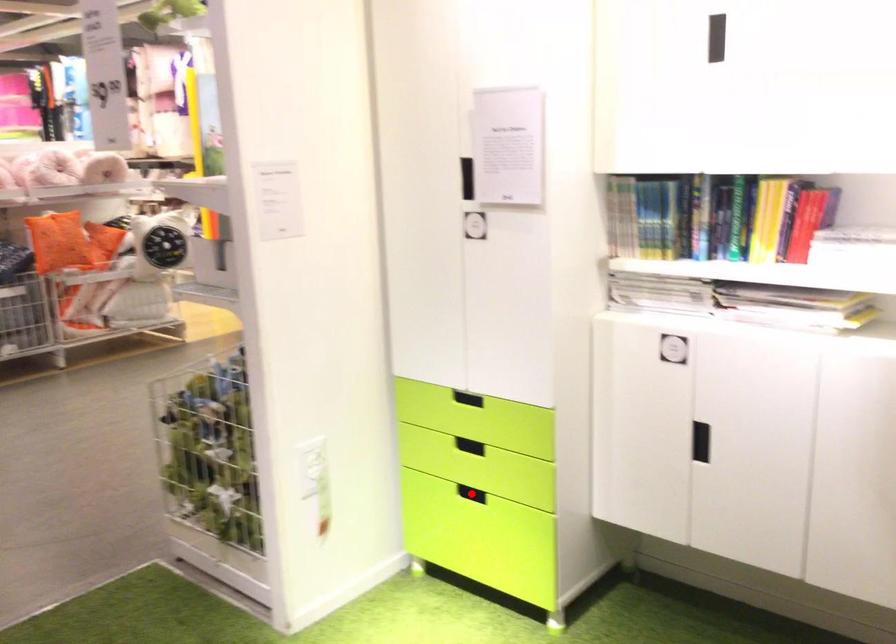
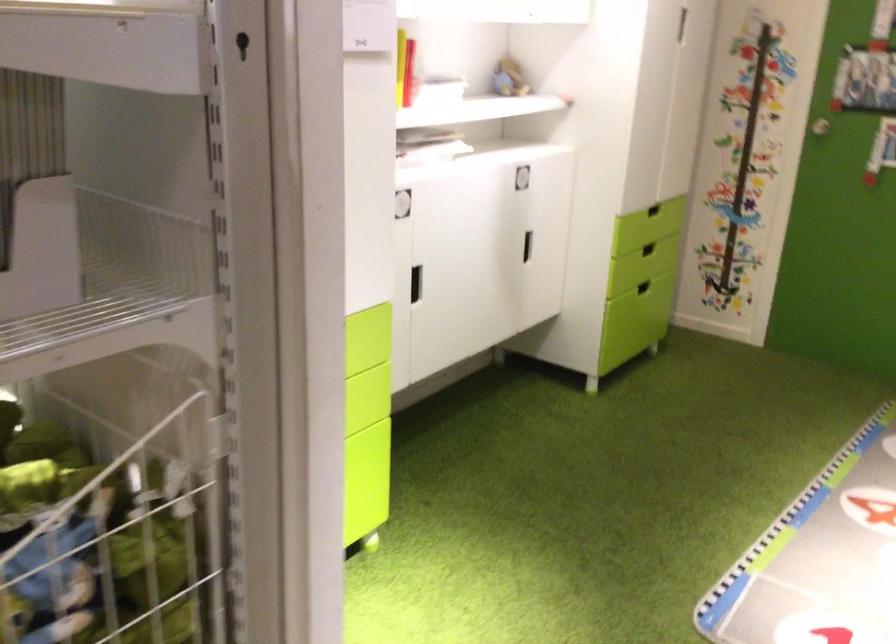
Question: I am providing you with two images of the same scene from different viewpoints. A red point is marked on the first image. At the location where the point appears in image 1, is it still visible in image 2?

Choices:
 (A) Yes
 (B) No

Answer: (B)